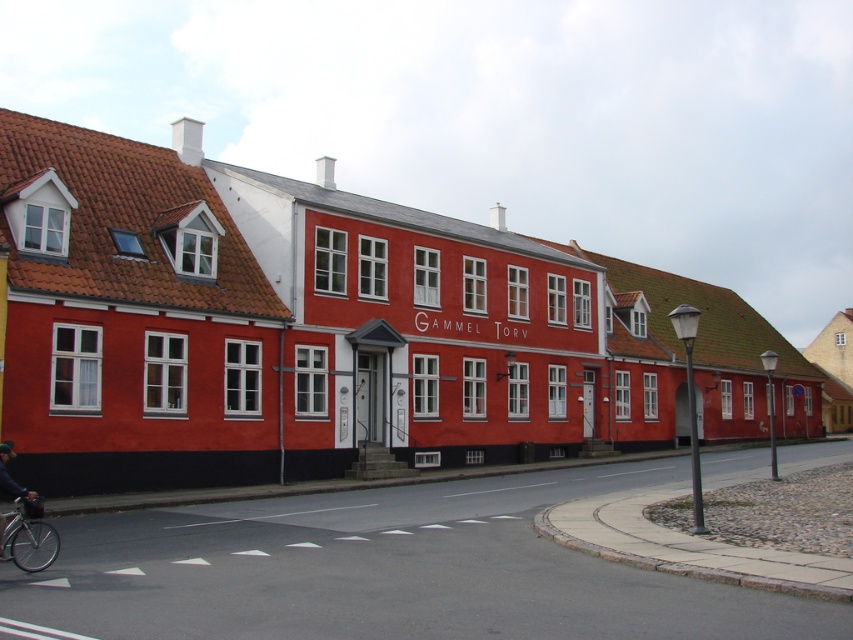
Question: Which of the following is the closest to the observer?

Choices:
 (A) dark blue fabric jacket at lower left
 (B) silver metallic bicycle at lower left

Answer: (A)

Question: Is silver metallic bicycle at lower left wider than dark blue fabric jacket at lower left?

Choices:
 (A) yes
 (B) no

Answer: (B)

Question: Which point is closer to the camera?

Choices:
 (A) (0, 515)
 (B) (39, 540)

Answer: (A)

Question: Can you confirm if silver metallic bicycle at lower left is thinner than dark blue fabric jacket at lower left?

Choices:
 (A) no
 (B) yes

Answer: (B)

Question: Which point is farther to the camera?

Choices:
 (A) [44, 556]
 (B) [1, 534]

Answer: (A)

Question: Is silver metallic bicycle at lower left smaller than dark blue fabric jacket at lower left?

Choices:
 (A) yes
 (B) no

Answer: (A)